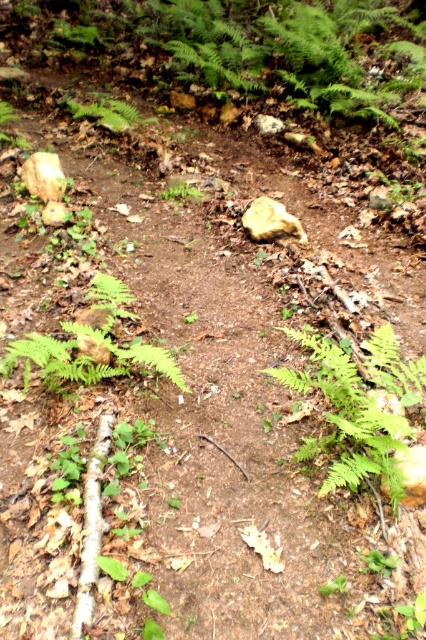
Which of these two, green leafy fern at center or green matte fern at center, stands shorter?

green matte fern at center

Who is positioned more to the right, green leafy fern at center or green matte fern at center?

green leafy fern at center

Is point (403, 400) in front of point (25, 371)?

No, it is not.

Where is `green leafy fern at center`? Image resolution: width=426 pixels, height=640 pixels. green leafy fern at center is located at coordinates (348, 419).

The width and height of the screenshot is (426, 640). What do you see at coordinates (91, 346) in the screenshot?
I see `green matte fern at center` at bounding box center [91, 346].

Based on the photo, is green matte fern at center closer to the viewer compared to green matte fern at upper center?

Yes, it is.

Between point (29, 371) and point (141, 120), which one is positioned behind?

Point (141, 120)

The height and width of the screenshot is (640, 426). I want to click on green matte fern at center, so click(91, 346).

Can you confirm if green leafy fern at center is smaller than green matte fern at upper center?

No, green leafy fern at center is not smaller than green matte fern at upper center.

Which is behind, point (360, 444) or point (118, 125)?

The point (118, 125) is behind.

At what (x,y) coordinates should I click in order to perform the action: click on green leafy fern at center. Please return your answer as a coordinate pair (x, y). The image size is (426, 640). Looking at the image, I should click on (348, 419).